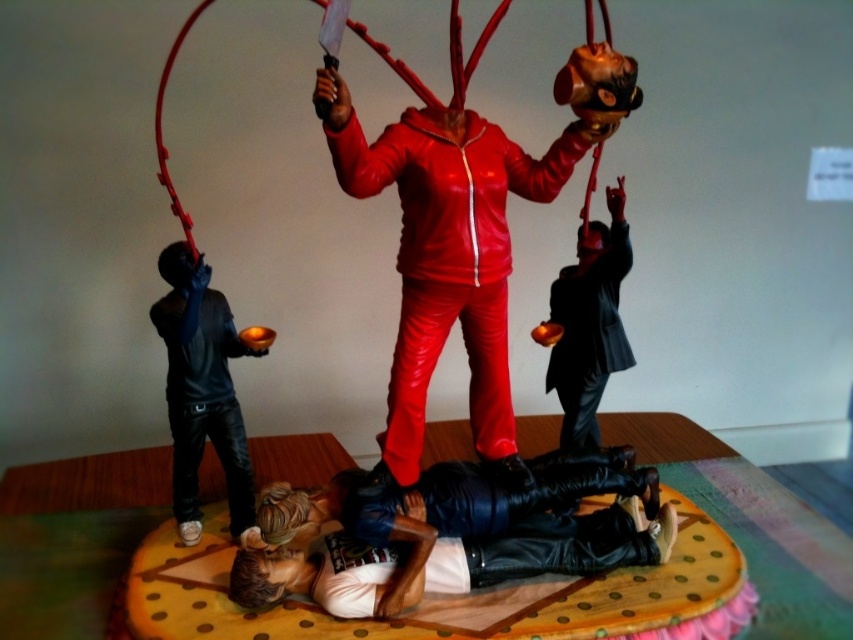
You are a detective examining the scene from the image. You need to determine the spatial relationship between the shiny red suit at center and the black leather jacket at left. Based on your observation, which object is closer to you?

The shiny red suit at center is closer to you because it is in front of the black leather jacket at left.

You are a detective examining the scene from above. You see the black leather jacket at left and the matte black suit at center. Which object is closer to you?

The black leather jacket at left is closer to you because it is in front of the matte black suit at center.

You are a delivery robot with a package that needs to be placed between the shiny red suit at center and the black leather jacket at left. The package is 12 inches long. Can you fit it between them without moving the objects?

The shiny red suit at center is 12.47 inches away from the black leather jacket at left. Since the package is 12 inches long, it can fit between them as the distance is slightly more than the package length.